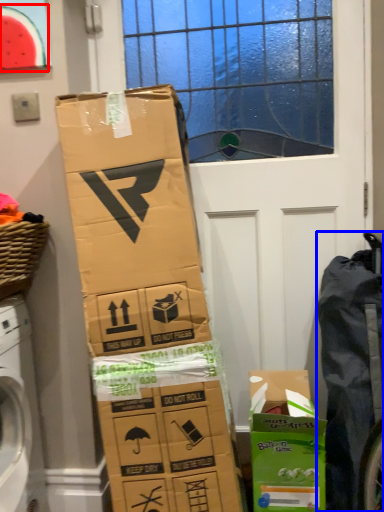
Question: Which point is further to the camera, watermelon (highlighted by a red box) or waste (highlighted by a blue box)?

Choices:
 (A) watermelon
 (B) waste

Answer: (A)